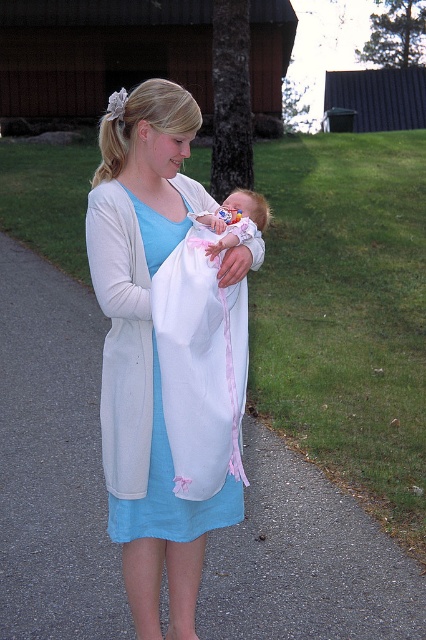
Question: Does white cotton dress at center come behind pink fabric baby at center?

Choices:
 (A) no
 (B) yes

Answer: (B)

Question: Which of the following is the closest to the observer?

Choices:
 (A) (236, 268)
 (B) (134, 525)

Answer: (A)

Question: Does white cotton dress at center appear over pink fabric baby at center?

Choices:
 (A) yes
 (B) no

Answer: (B)

Question: Which of the following is the closest to the observer?

Choices:
 (A) (115, 525)
 (B) (229, 243)

Answer: (B)

Question: Which object is closer to the camera taking this photo?

Choices:
 (A) white cotton dress at center
 (B) pink fabric baby at center

Answer: (B)

Question: Can you confirm if white cotton dress at center is bigger than pink fabric baby at center?

Choices:
 (A) no
 (B) yes

Answer: (B)